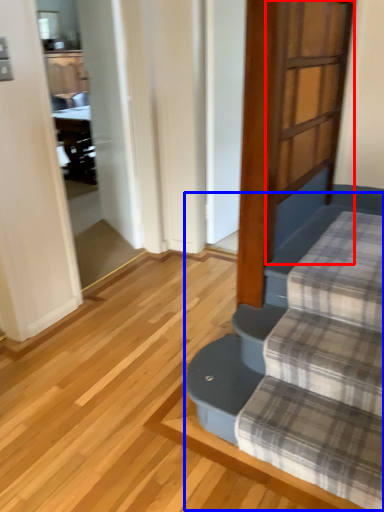
Question: Which object appears closest to the camera in this image, screen door (highlighted by a red box) or stairwell (highlighted by a blue box)?

Choices:
 (A) screen door
 (B) stairwell

Answer: (B)